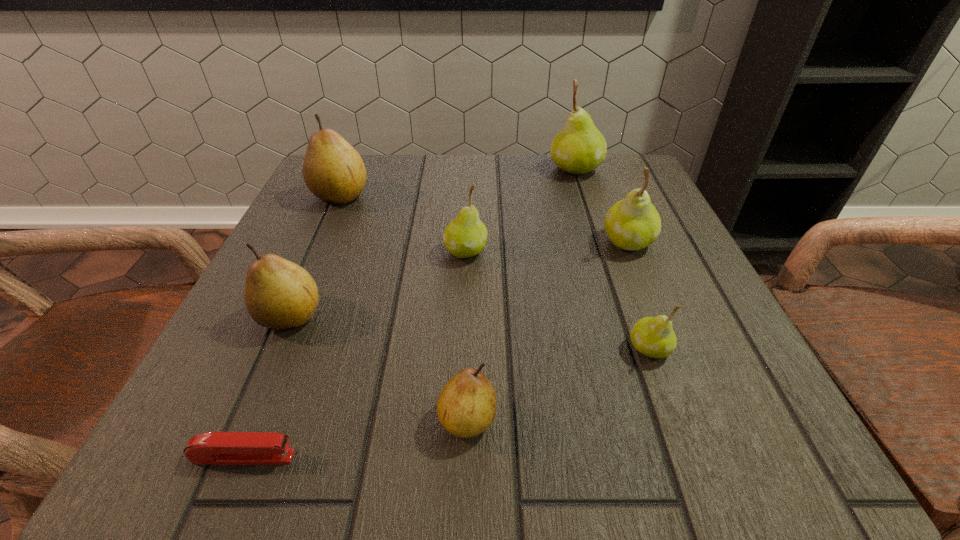
The image size is (960, 540). Identify the location of vacant area at the near right corner of the desktop. (735, 402).

Locate an element on the screen. This screenshot has width=960, height=540. empty space that is in between the second biggest green pear and the red stapler is located at coordinates (436, 349).

Where is `unoccupied position between the third biggest green pear and the shortest object`? The image size is (960, 540). unoccupied position between the third biggest green pear and the shortest object is located at coordinates (355, 354).

At what (x,y) coordinates should I click in order to perform the action: click on vacant area between the tallest pear and the second smallest brown pear. Please return your answer as a coordinate pair (x, y). The image size is (960, 540). Looking at the image, I should click on (433, 242).

This screenshot has width=960, height=540. In order to click on free point between the tallest pear and the smallest brown pear in this screenshot , I will do `click(521, 294)`.

Where is `free spot between the nearest green pear and the third biggest green pear`? This screenshot has width=960, height=540. free spot between the nearest green pear and the third biggest green pear is located at coordinates (558, 300).

Locate an element on the screen. The image size is (960, 540). vacant area between the smallest green pear and the third smallest green pear is located at coordinates (638, 295).

Identify the location of empty space between the biggest brown pear and the nearest green pear. tap(494, 272).

Find the location of a particular element. Image resolution: width=960 pixels, height=540 pixels. vacant area that lies between the third smallest green pear and the second nearest brown pear is located at coordinates (459, 279).

Identify which object is the second nearest to the shortest object. Please provide its 2D coordinates. Your answer should be formatted as a tuple, i.e. [(x, y)], where the tuple contains the x and y coordinates of a point satisfying the conditions above.

[(279, 294)]